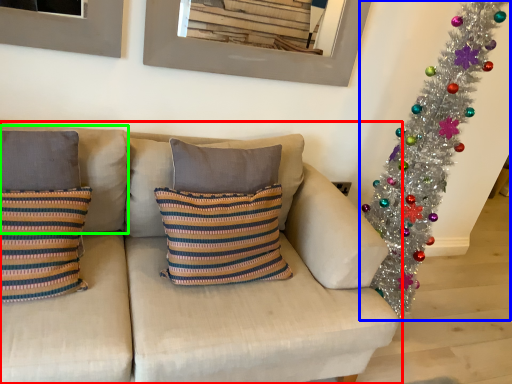
Question: Estimate the real-world distances between objects in this image. Which object is farther from studio couch (highlighted by a red box), christmas tree (highlighted by a blue box) or pillow (highlighted by a green box)?

Choices:
 (A) christmas tree
 (B) pillow

Answer: (A)